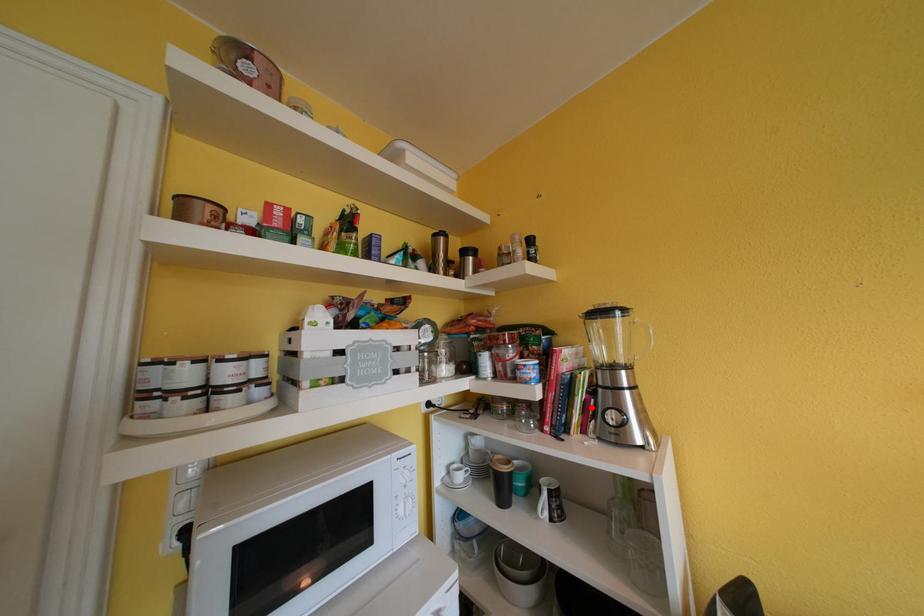
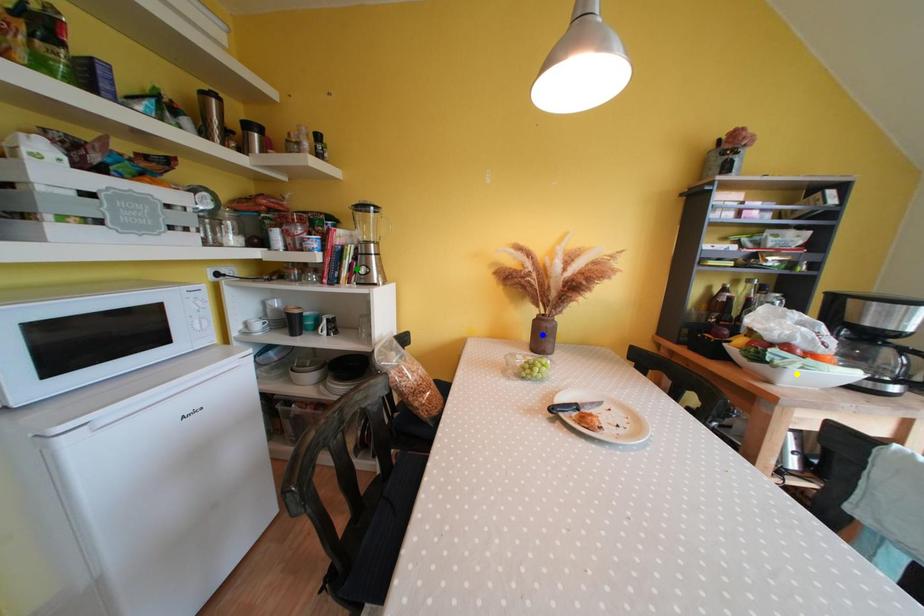
Question: I am providing you with two images of the same scene from different viewpoints. A red point is marked on the first image. You are given multiple points on the second image. In image 2, which mark is for the same physical point as the one in image 1?

Choices:
 (A) green point
 (B) yellow point
 (C) blue point

Answer: (A)